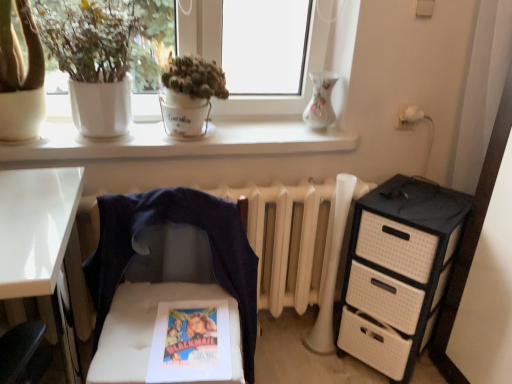
Locate an element on the screen. This screenshot has height=384, width=512. free point above matte paper comic book at center (from a real-world perspective) is located at coordinates (192, 334).